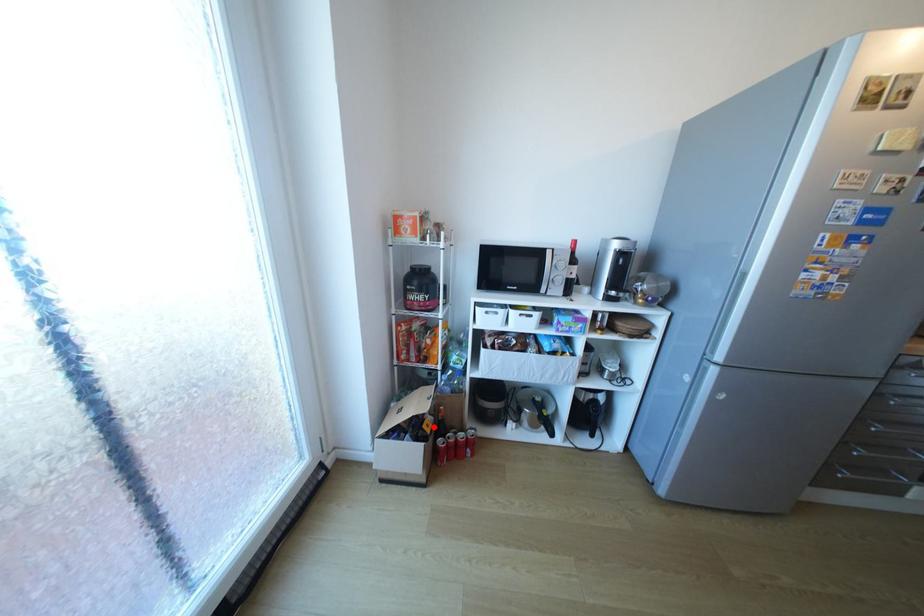
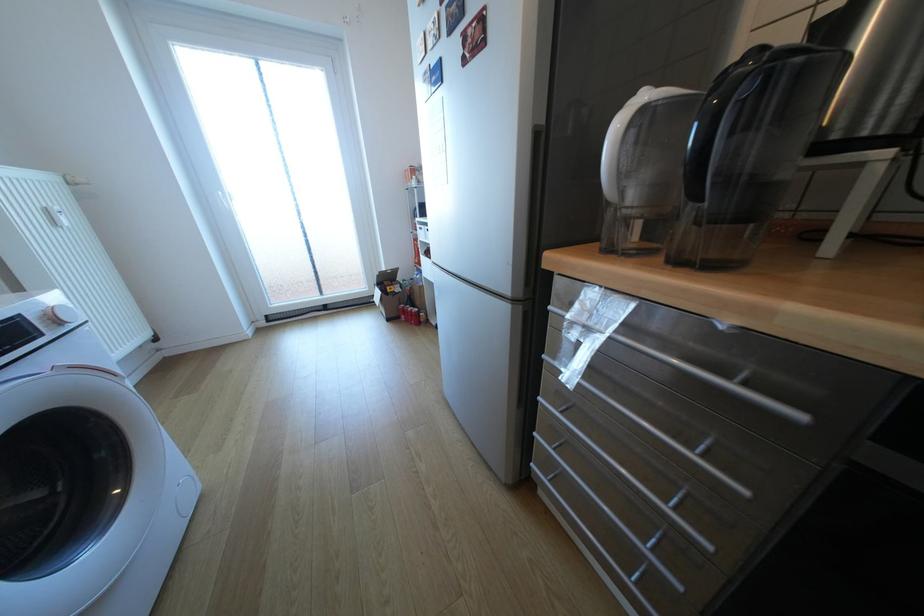
Question: A red point is marked in image1. In image2, is the corresponding 3D point closer to the camera or farther? Reply with the corresponding letter.

Choices:
 (A) The corresponding 3D point is closer.
 (B) The corresponding 3D point is farther.

Answer: (A)